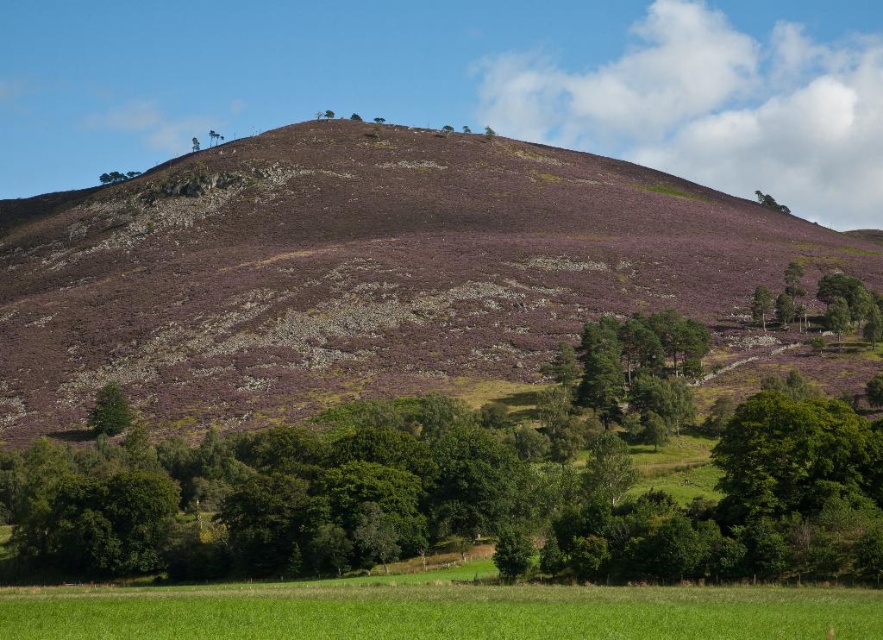
Question: Does purple heather at upper center have a smaller size compared to green leafy tree at lower right?

Choices:
 (A) no
 (B) yes

Answer: (A)

Question: Among these objects, which one is farthest from the camera?

Choices:
 (A) green leafy tree at lower right
 (B) green leafy tree at upper right
 (C) green leafy tree at lower left

Answer: (B)

Question: Does purple heather at upper center appear on the left side of green leafy tree at upper center?

Choices:
 (A) yes
 (B) no

Answer: (B)

Question: Among these objects, which one is farthest from the camera?

Choices:
 (A) green leafy tree at lower left
 (B) green leafy tree at upper right
 (C) green leafy tree at upper center
 (D) green leafy tree at lower right

Answer: (B)

Question: Which point is farther from the camera taking this photo?

Choices:
 (A) (768, 252)
 (B) (134, 176)

Answer: (B)

Question: Can you confirm if green leafy tree at lower left is positioned to the right of green leafy tree at upper right?

Choices:
 (A) yes
 (B) no

Answer: (B)